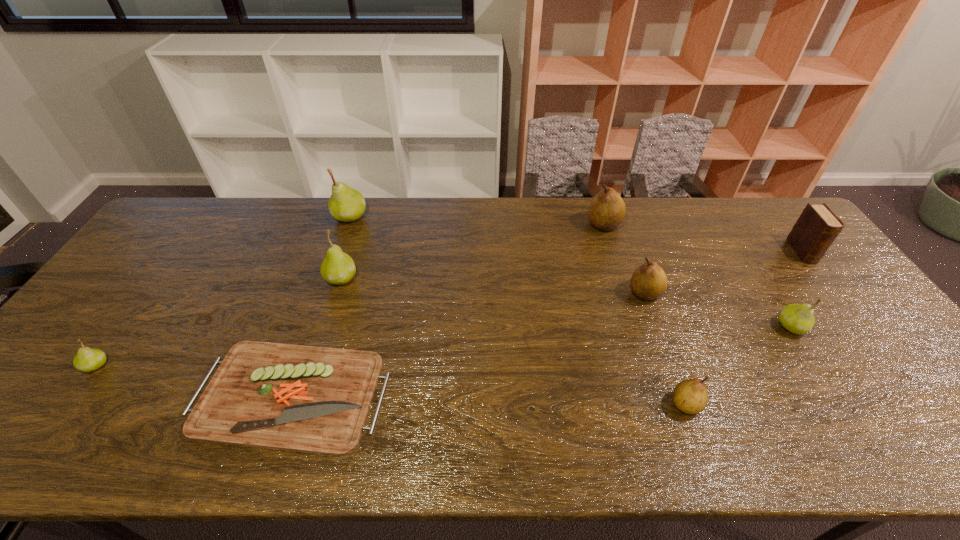
The image size is (960, 540). Find the location of `the tallest pear`. the tallest pear is located at coordinates click(x=346, y=204).

Locate an element on the screen. This screenshot has height=540, width=960. the biggest green pear is located at coordinates (346, 204).

Locate an element on the screen. This screenshot has width=960, height=540. the biggest brown pear is located at coordinates (607, 209).

The image size is (960, 540). What are the coordinates of `the third smallest green pear` in the screenshot? It's located at 338,267.

Where is `the third farthest object`? This screenshot has height=540, width=960. the third farthest object is located at coordinates (817, 227).

I want to click on brown diary, so click(817, 227).

Image resolution: width=960 pixels, height=540 pixels. Find the location of `the second farthest brown pear`. the second farthest brown pear is located at coordinates (649, 281).

You are a GUI agent. You are given a task and a screenshot of the screen. Output one action in this format:
    pyautogui.click(x=<x>, y=<y>)
    Task: Click on the rightmost pear
    This screenshot has height=540, width=960.
    Given the screenshot: What is the action you would take?
    pyautogui.click(x=798, y=319)

Locate an element on the screen. The image size is (960, 540). the second smallest green pear is located at coordinates (798, 319).

At what (x,y) coordinates should I click in order to perform the action: click on the second nearest pear. Please return your answer as a coordinate pair (x, y). The width and height of the screenshot is (960, 540). Looking at the image, I should click on (87, 359).